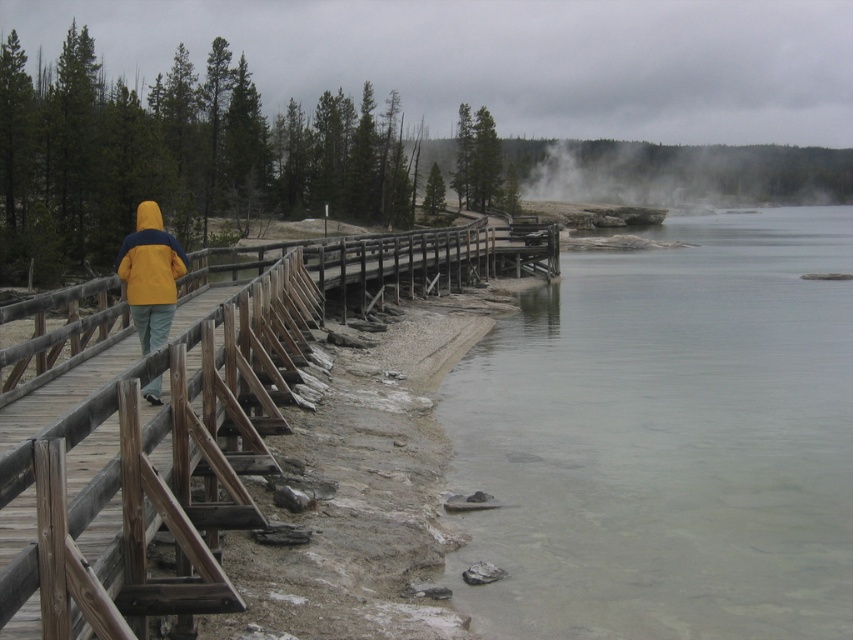
Question: Does clear water at lower right have a smaller size compared to wooden rail at center?

Choices:
 (A) yes
 (B) no

Answer: (B)

Question: Is clear water at lower right below yellow matte jacket at center?

Choices:
 (A) no
 (B) yes

Answer: (B)

Question: Which of these objects is positioned farthest from the clear water at lower right?

Choices:
 (A) yellow matte jacket at center
 (B) wooden rail at center

Answer: (A)

Question: Which point is closer to the camera?

Choices:
 (A) yellow matte jacket at center
 (B) clear water at lower right

Answer: (A)

Question: Which point is farther from the camera taking this photo?

Choices:
 (A) (144, 618)
 (B) (752, 301)
 (C) (155, 397)

Answer: (B)

Question: Is the position of clear water at lower right less distant than that of wooden rail at center?

Choices:
 (A) no
 (B) yes

Answer: (A)